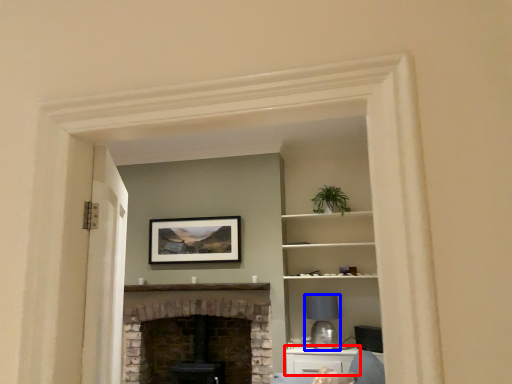
Question: Among these objects, which one is nearest to the camera, cabinetry (highlighted by a red box) or lamp (highlighted by a blue box)?

Choices:
 (A) cabinetry
 (B) lamp

Answer: (A)